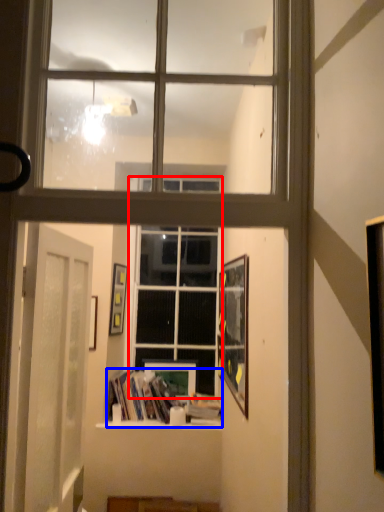
Question: Which object is further to the camera taking this photo, window (highlighted by a red box) or book (highlighted by a blue box)?

Choices:
 (A) window
 (B) book

Answer: (A)